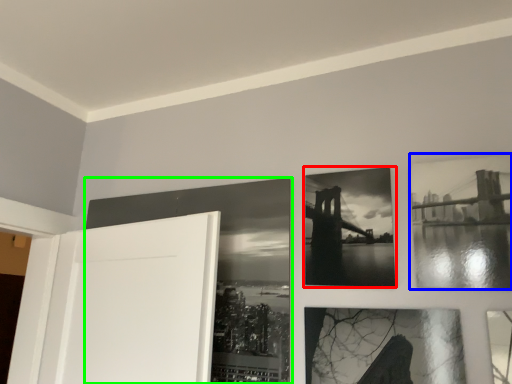
Question: Which is farther away from picture frame (highlighted by a red box)? picture frame (highlighted by a blue box) or picture frame (highlighted by a green box)?

Choices:
 (A) picture frame
 (B) picture frame

Answer: (B)